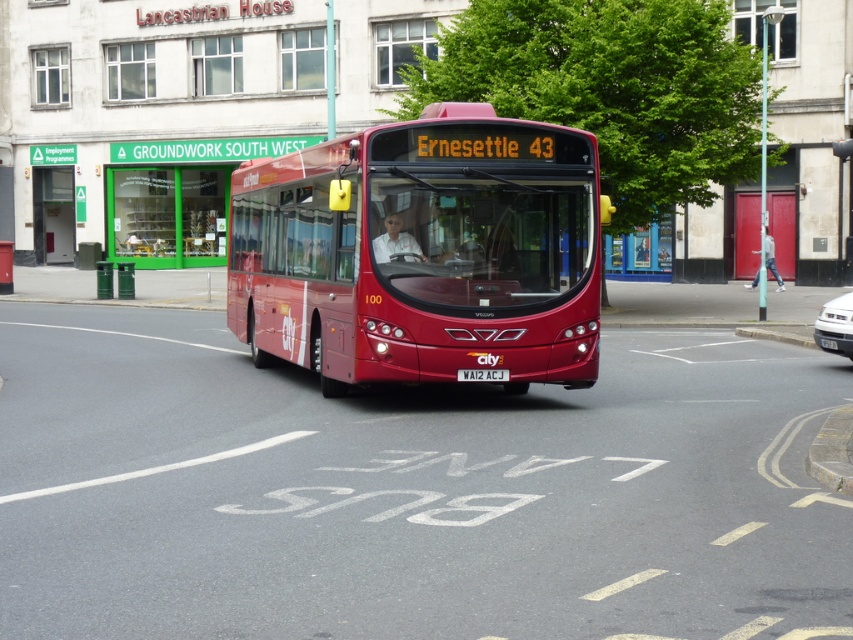
You are a pedestrian standing on the sidewalk. You see the shiny red bus at center and the white plastic license plate at center. Which object is closer to the left side of your view?

The shiny red bus at center is closer to the left side of your view because it is positioned to the left of the white plastic license plate at center.

You are a pedestrian standing on the sidewalk and see the shiny red bus at center and the silver metallic car at right. Which vehicle is closer to the left side of the street?

The shiny red bus at center is closer to the left side of the street because it is positioned to the left of the silver metallic car at right.

You are standing on the sidewalk observing the scene. There is a point at coordinate (422, 252). Which object is this point located on?

The point at coordinate (422, 252) is located on the shiny red bus at center.